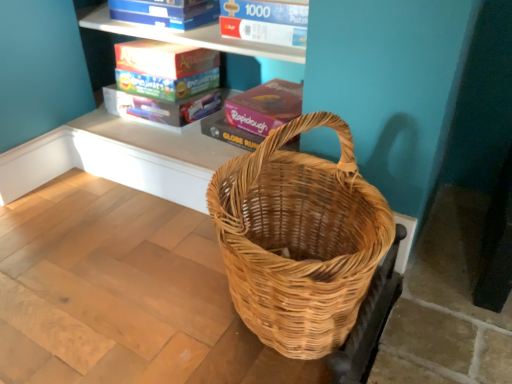
Image resolution: width=512 pixels, height=384 pixels. What do you see at coordinates (166, 12) in the screenshot?
I see `blue cardboard book at upper center` at bounding box center [166, 12].

In order to click on blue cardboard book at upper center in this screenshot , I will do `click(166, 12)`.

I want to click on blue cardboard book at upper center, so click(x=166, y=12).